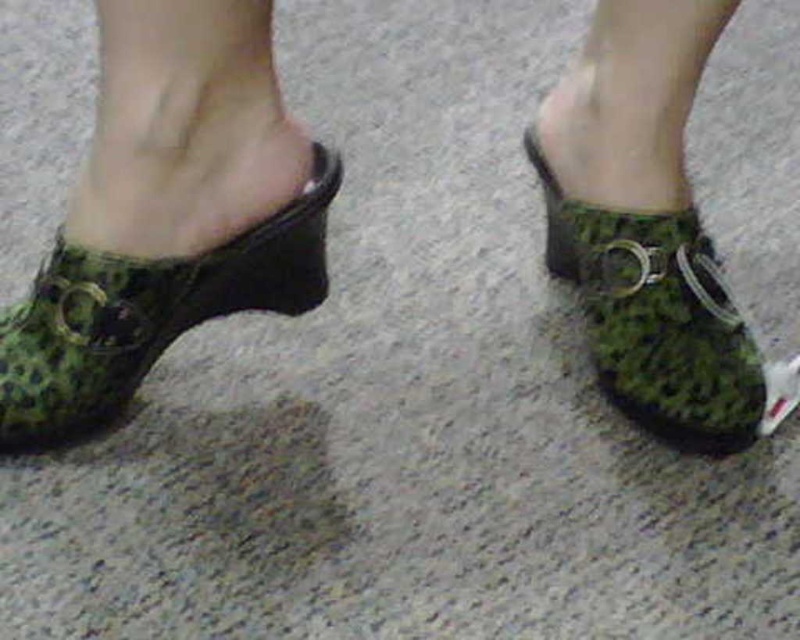
Question: Among these objects, which one is nearest to the camera?

Choices:
 (A) green leopard print clog at left
 (B) green textured clog at center

Answer: (A)

Question: Does green leopard print clogs at center have a larger size compared to green textured clog at center?

Choices:
 (A) yes
 (B) no

Answer: (A)

Question: Can you confirm if green leopard print clogs at center is smaller than green leopard print clog at left?

Choices:
 (A) yes
 (B) no

Answer: (B)

Question: Which point is closer to the camera taking this photo?

Choices:
 (A) pyautogui.click(x=102, y=256)
 (B) pyautogui.click(x=328, y=196)

Answer: (A)

Question: Does green leopard print clogs at center appear on the left side of green leopard print clog at left?

Choices:
 (A) no
 (B) yes

Answer: (A)

Question: Which of the following is the farthest from the observer?

Choices:
 (A) green leopard print clog at left
 (B) green leopard print clogs at center

Answer: (A)